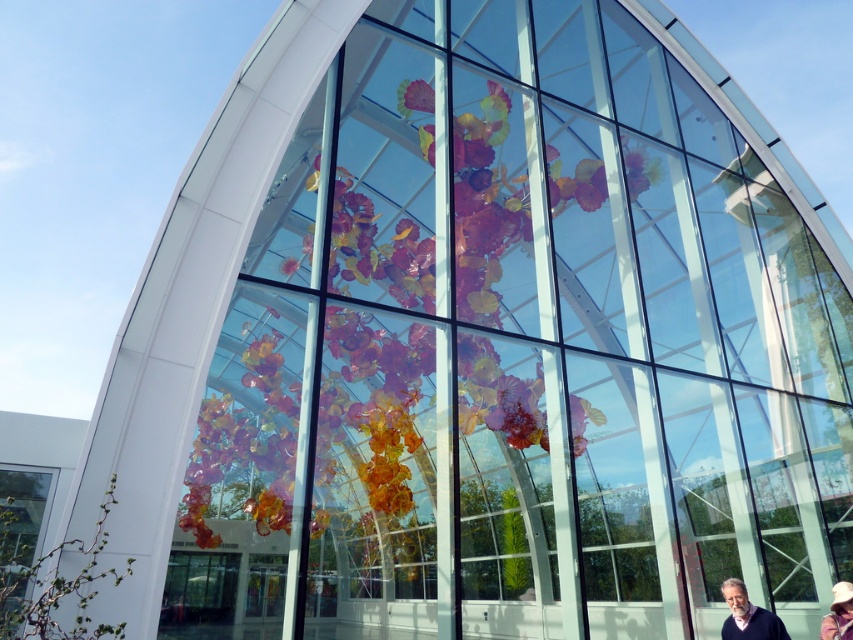
Which is behind, point (776, 627) or point (837, 605)?

Positioned behind is point (837, 605).

Can you confirm if matte black sweater at lower right is wider than white textured hat at lower right?

Yes, matte black sweater at lower right is wider than white textured hat at lower right.

Describe the element at coordinates (747, 616) in the screenshot. The height and width of the screenshot is (640, 853). I see `matte black sweater at lower right` at that location.

At what (x,y) coordinates should I click in order to perform the action: click on matte black sweater at lower right. Please return your answer as a coordinate pair (x, y). Looking at the image, I should click on (747, 616).

Which is below, translucent glass flower at center or white textured hat at lower right?

white textured hat at lower right is below.

How much distance is there between translucent glass flower at center and white textured hat at lower right?

A distance of 8.49 meters exists between translucent glass flower at center and white textured hat at lower right.

Image resolution: width=853 pixels, height=640 pixels. What do you see at coordinates (485, 209) in the screenshot?
I see `translucent glass flower at center` at bounding box center [485, 209].

Where is `translucent glass flower at center`? translucent glass flower at center is located at coordinates (485, 209).

Is translucent glass flower at center smaller than matte black sweater at lower right?

Actually, translucent glass flower at center might be larger than matte black sweater at lower right.

Does point (421, 262) lie behind point (740, 636)?

Yes.

Locate an element on the screen. The image size is (853, 640). translucent glass flower at center is located at coordinates (485, 209).

What are the coordinates of `translucent glass flower at center` in the screenshot? It's located at (485, 209).